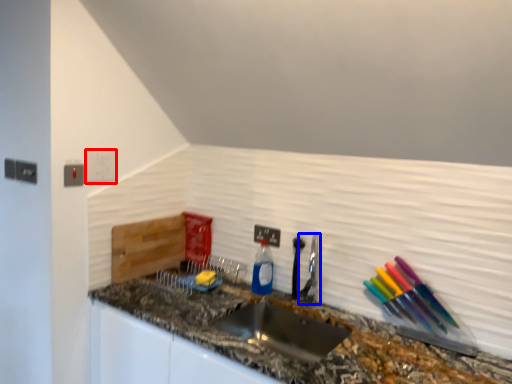
Question: Which object appears closest to the camera in this image, light switch (highlighted by a red box) or faucet (highlighted by a blue box)?

Choices:
 (A) light switch
 (B) faucet

Answer: (B)